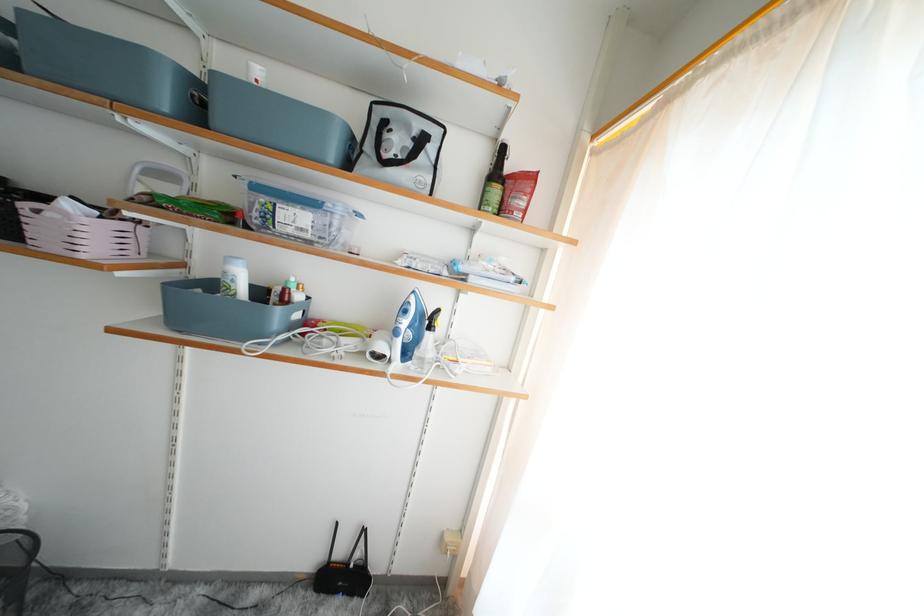
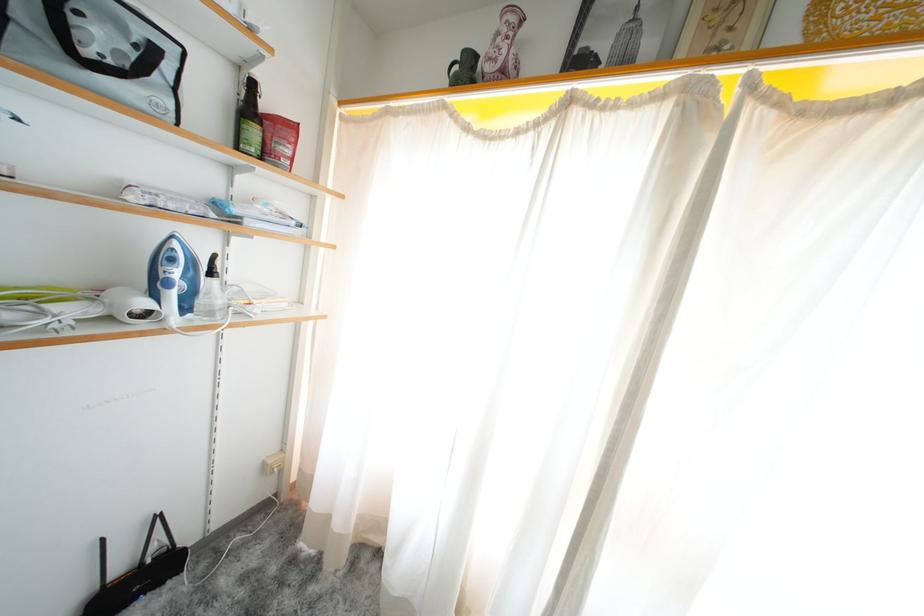
Find the pixel in the second image that matches (x=419, y=296) in the first image.

(178, 241)